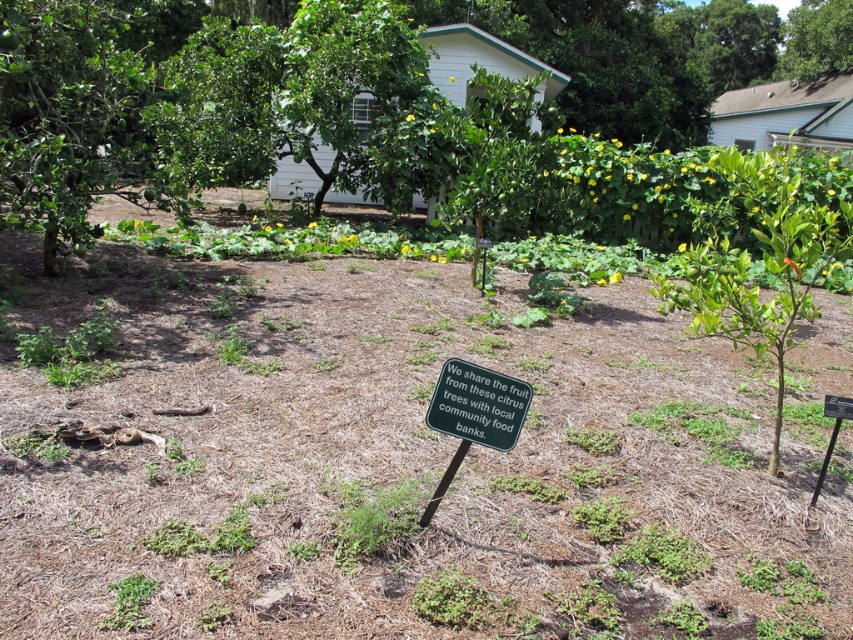
Question: Which point is farther to the camera?

Choices:
 (A) (393, 93)
 (B) (399, 60)
 (C) (434, 420)

Answer: (A)

Question: Is green leafy tree at center further to camera compared to green leafy tree at upper right?

Choices:
 (A) yes
 (B) no

Answer: (B)

Question: Which point is closer to the camera?

Choices:
 (A) [x=387, y=67]
 (B) [x=523, y=161]
 (C) [x=463, y=422]
 (D) [x=811, y=20]

Answer: (C)

Question: Does green plastic sign at center have a greater width compared to green leafy tree at upper right?

Choices:
 (A) yes
 (B) no

Answer: (B)

Question: Which point is closer to the camera?

Choices:
 (A) green plastic sign at center
 (B) green leafy tree at upper center

Answer: (A)

Question: Is green leafy tree at upper center to the right of green plastic sign at center from the viewer's perspective?

Choices:
 (A) no
 (B) yes

Answer: (A)